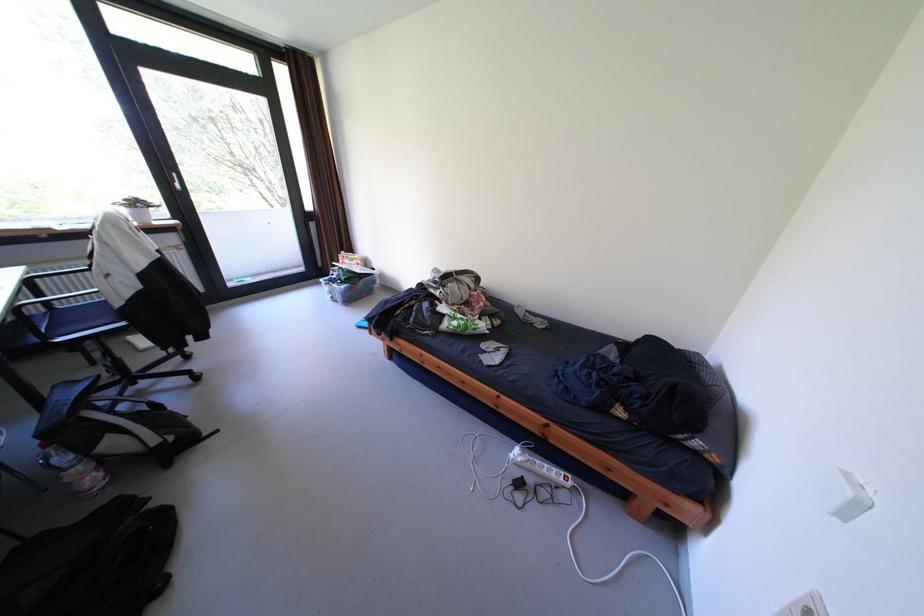
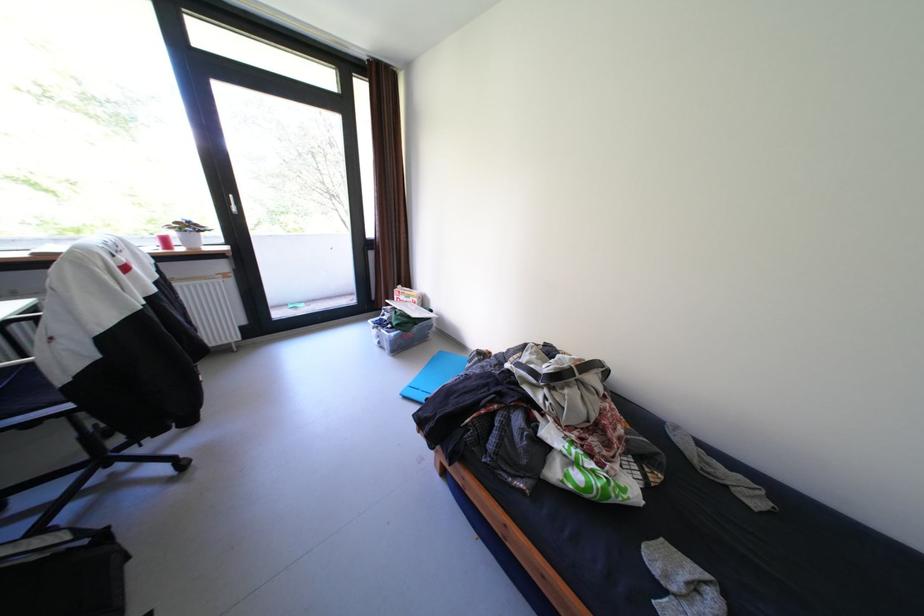
The images are taken continuously from a first-person perspective. In which direction are you moving?

The cameraman moved toward left, forward.